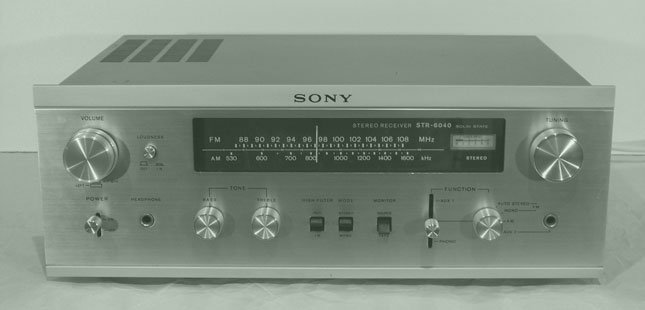
Where is `knobs`? This screenshot has width=645, height=310. knobs is located at coordinates (548, 155), (484, 230), (428, 231), (264, 228), (213, 226), (95, 157), (149, 157), (93, 228).